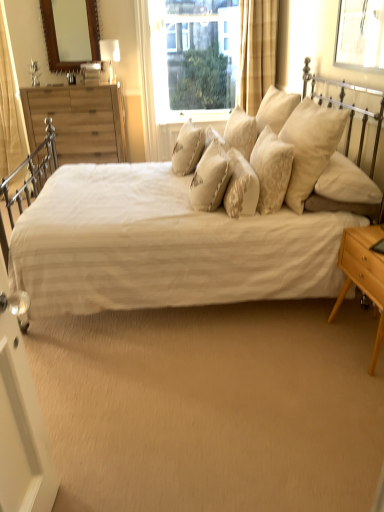
I want to click on vacant region below light wood/texture nightstand at lower right (from a real-world perspective), so click(359, 336).